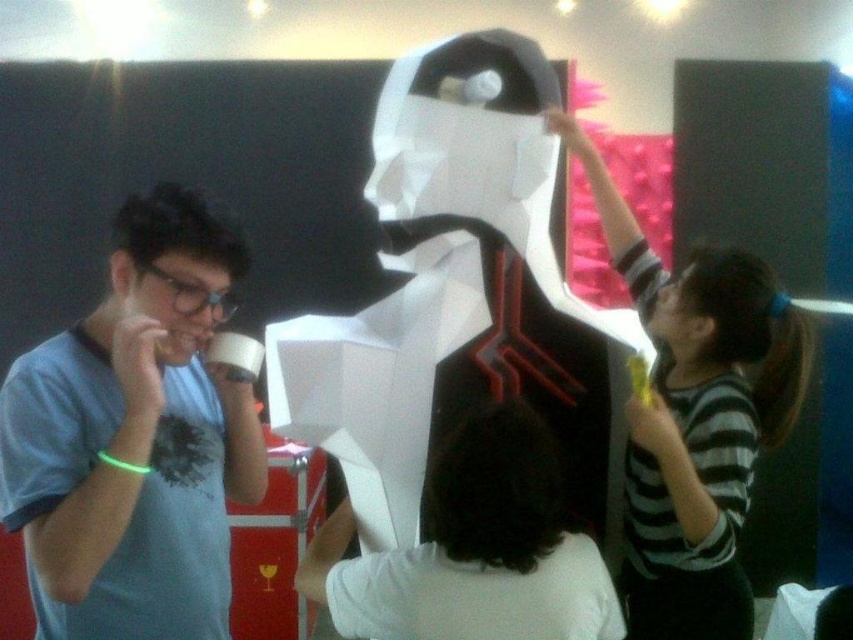
Who is more distant from viewer, (152, 563) or (457, 492)?

Positioned behind is point (152, 563).

Between point (94, 337) and point (529, 637), which one is positioned in front?

Point (529, 637) is in front.

Who is more forward, (219, 397) or (502, 616)?

Point (502, 616) is in front.

At what (x,y) coordinates should I click in order to perform the action: click on light blue t-shirt at left. Please return your answer as a coordinate pair (x, y). Image resolution: width=853 pixels, height=640 pixels. Looking at the image, I should click on (135, 438).

Which is more to the left, white paper sculpture at center or white matte shirt at center?

From the viewer's perspective, white matte shirt at center appears more on the left side.

From the picture: Can you confirm if white paper sculpture at center is taller than white matte shirt at center?

Yes.

Which is in front, point (473, 161) or point (491, 472)?

Point (491, 472) is more forward.

This screenshot has height=640, width=853. Find the location of `white paper sculpture at center`. white paper sculpture at center is located at coordinates (451, 296).

Is striped shirt at upper right behind white matte shirt at center?

Yes, striped shirt at upper right is behind white matte shirt at center.

Does striped shirt at upper right have a smaller size compared to white matte shirt at center?

Incorrect, striped shirt at upper right is not smaller in size than white matte shirt at center.

The image size is (853, 640). What do you see at coordinates (695, 417) in the screenshot? I see `striped shirt at upper right` at bounding box center [695, 417].

Find the location of a particular element. striped shirt at upper right is located at coordinates (695, 417).